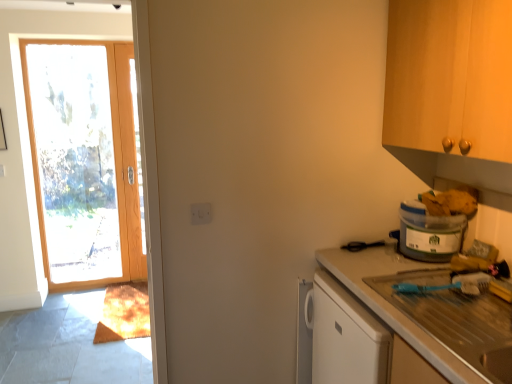
Question: Does point (439, 231) appear closer or farther from the camera than point (373, 274)?

Choices:
 (A) farther
 (B) closer

Answer: (A)

Question: Considering the relative positions of translucent plastic container at right and smooth white countertop at right in the image provided, is translucent plastic container at right to the left or to the right of smooth white countertop at right?

Choices:
 (A) left
 (B) right

Answer: (B)

Question: Based on their relative distances, which object is farther from the translucent plastic container at right?

Choices:
 (A) wooden door at left
 (B) white plastic electric outlet at center
 (C) smooth white countertop at right

Answer: (A)

Question: Which object is the closest to the white plastic electric outlet at center?

Choices:
 (A) smooth white countertop at right
 (B) translucent plastic container at right
 (C) wooden door at left

Answer: (A)